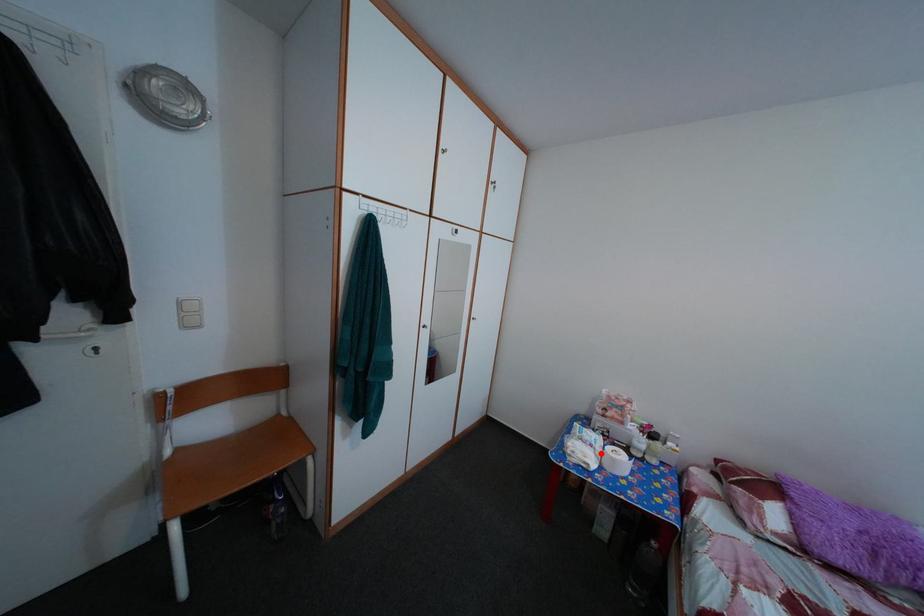
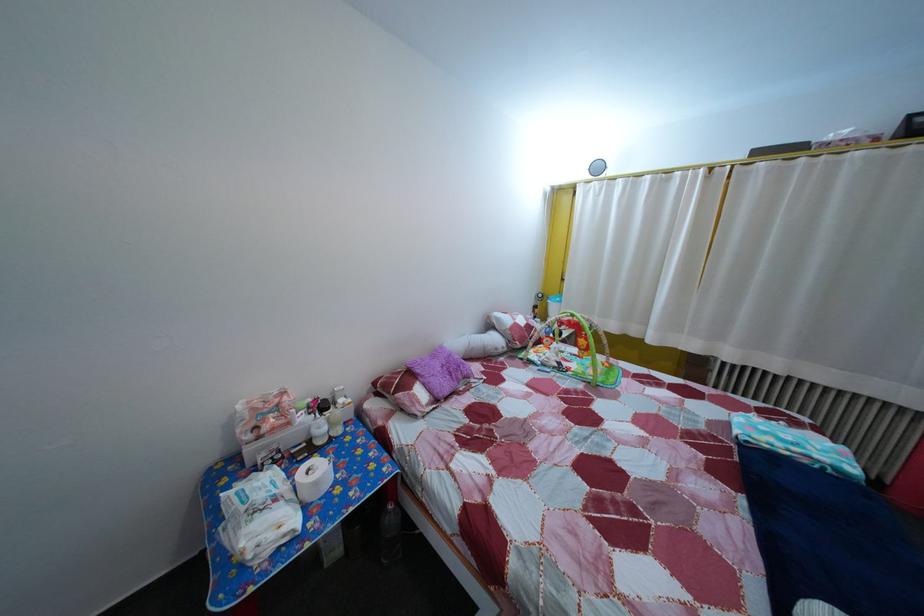
Question: A red point is marked in image1. In image2, is the corresponding 3D point closer to the camera or farther? Reply with the corresponding letter.

Choices:
 (A) The corresponding 3D point is closer.
 (B) The corresponding 3D point is farther.

Answer: (A)